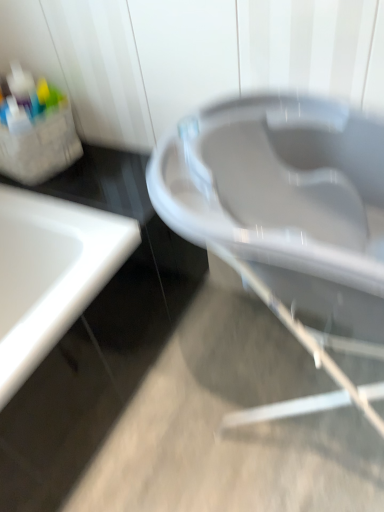
The height and width of the screenshot is (512, 384). What do you see at coordinates (50, 274) in the screenshot?
I see `white glossy sink at left` at bounding box center [50, 274].

The width and height of the screenshot is (384, 512). What are the coordinates of `white glossy sink at left` in the screenshot? It's located at (50, 274).

What is the approximate height of white plastic bath at center?

It is 33.02 inches.

The height and width of the screenshot is (512, 384). Describe the element at coordinates (284, 207) in the screenshot. I see `white plastic bath at center` at that location.

Locate an element on the screen. The height and width of the screenshot is (512, 384). white plastic bath at center is located at coordinates (284, 207).

This screenshot has width=384, height=512. Identify the location of white glossy sink at left. (50, 274).

Considering the positions of objects white plastic bath at center and white glossy sink at left in the image provided, who is more to the right, white plastic bath at center or white glossy sink at left?

white plastic bath at center is more to the right.

Does white plastic bath at center lie behind white glossy sink at left?

No.

Does point (157, 199) come farther from viewer compared to point (42, 199)?

No, it is in front of (42, 199).

From the image's perspective, is white plastic bath at center over white glossy sink at left?

Yes, from the image's perspective, white plastic bath at center is on top of white glossy sink at left.

From a real-world perspective, between white plastic bath at center and white glossy sink at left, who is vertically higher?

white plastic bath at center.

Considering the sizes of objects white plastic bath at center and white glossy sink at left in the image provided, who is thinner, white plastic bath at center or white glossy sink at left?

white plastic bath at center.

Who is taller, white plastic bath at center or white glossy sink at left?

white plastic bath at center is taller.

Is white plastic bath at center bigger than white glossy sink at left?

No, white plastic bath at center is not bigger than white glossy sink at left.

From the picture: Is white plastic bath at center positioned beyond the bounds of white glossy sink at left?

Yes, white plastic bath at center is located beyond the bounds of white glossy sink at left.

Is white plastic bath at center directly adjacent to white glossy sink at left?

No, white plastic bath at center is not making contact with white glossy sink at left.

Is white plastic bath at center facing towards white glossy sink at left?

No, white plastic bath at center is not aimed at white glossy sink at left.

Can you tell me how much white plastic bath at center and white glossy sink at left differ in facing direction?

There is a 90.1-degree angle between the facing directions of white plastic bath at center and white glossy sink at left.

I want to click on sink on the left of white plastic bath at center, so click(x=50, y=274).

Between white glossy sink at left and white plastic bath at center, which one appears on the right side from the viewer's perspective?

white plastic bath at center is more to the right.

Considering their positions, is white glossy sink at left located in front of or behind white plastic bath at center?

In the image, white glossy sink at left appears behind white plastic bath at center.

Which point is more forward, (x=46, y=264) or (x=190, y=218)?

The point (x=190, y=218) is in front.

From the image's perspective, which one is positioned higher, white glossy sink at left or white plastic bath at center?

From the image's view, white plastic bath at center is above.

In the scene shown: From a real-world perspective, is white glossy sink at left physically above white plastic bath at center?

Incorrect, from a real-world perspective, white glossy sink at left is lower than white plastic bath at center.

Looking at their sizes, would you say white glossy sink at left is wider or thinner than white plastic bath at center?

Considering their sizes, white glossy sink at left looks broader than white plastic bath at center.

Can you confirm if white glossy sink at left is shorter than white plastic bath at center?

Indeed, white glossy sink at left has a lesser height compared to white plastic bath at center.

Between white glossy sink at left and white plastic bath at center, which one has smaller size?

white plastic bath at center.

Is white plastic bath at center completely or partially inside white glossy sink at left?

Actually, white plastic bath at center is outside white glossy sink at left.

Is white glossy sink at left positioned far away from white plastic bath at center?

No, white glossy sink at left is in close proximity to white plastic bath at center.

Is white glossy sink at left facing away from white plastic bath at center?

No, white plastic bath at center is not at the back of white glossy sink at left.

How many degrees apart are the facing directions of white glossy sink at left and white plastic bath at center?

The angular difference between white glossy sink at left and white plastic bath at center is 90.1 degrees.

Where is `bath positioned vertically above the white glossy sink at left (from a real-world perspective)`? bath positioned vertically above the white glossy sink at left (from a real-world perspective) is located at coordinates (284, 207).

Image resolution: width=384 pixels, height=512 pixels. What are the coordinates of `bath above the white glossy sink at left (from a real-world perspective)` in the screenshot? It's located at (284, 207).

Identify the location of sink to the left of white plastic bath at center. (50, 274).